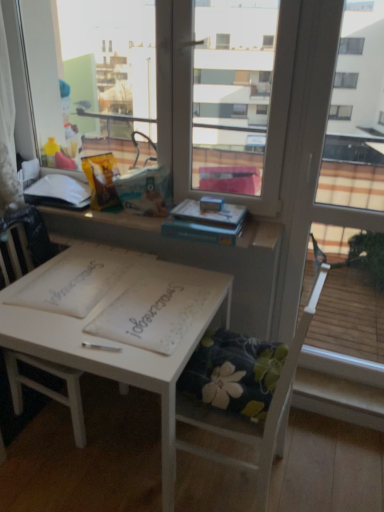
The width and height of the screenshot is (384, 512). I want to click on free point to the right of floral fabric cushion at lower center, the 1th chair when ordered from right to left, so click(329, 460).